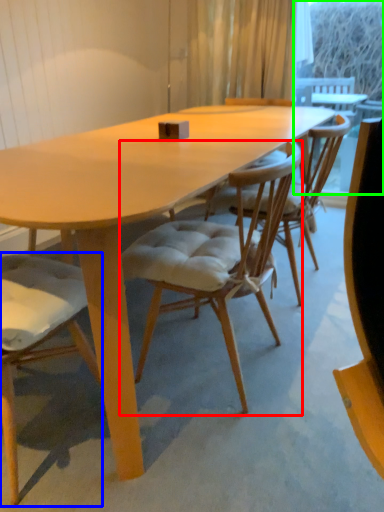
Question: Which object is positioned farthest from chair (highlighted by a red box)? Select from chair (highlighted by a blue box) and window screen (highlighted by a green box).

Choices:
 (A) chair
 (B) window screen

Answer: (B)